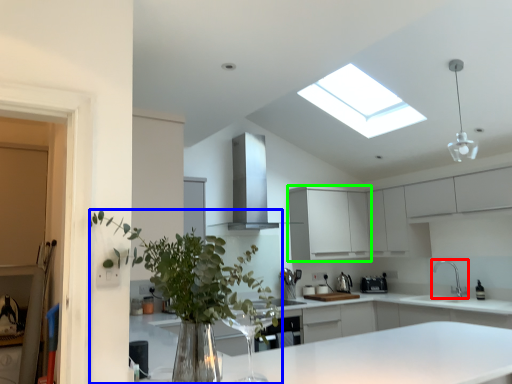
Question: Which object is the closest to the tap (highlighted by a red box)? Choose among these: houseplant (highlighted by a blue box) or cabinetry (highlighted by a green box).

Choices:
 (A) houseplant
 (B) cabinetry

Answer: (B)